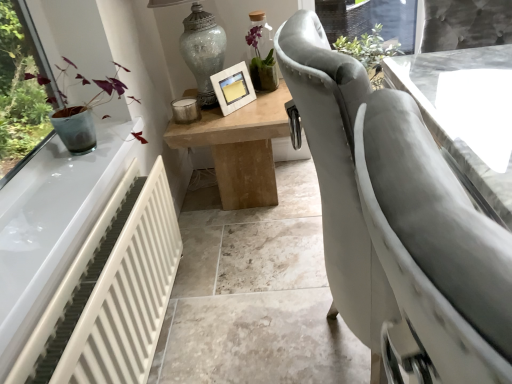
In order to click on free space to the left of white textured picture frame at center in this screenshot , I will do `click(206, 117)`.